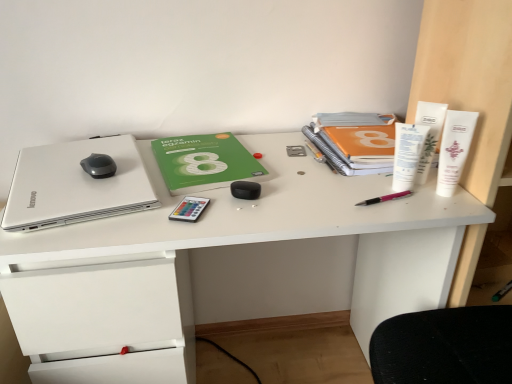
Image resolution: width=512 pixels, height=384 pixels. I want to click on free area in between black plastic remote control at center-left, positioned as the fifth stationery in right-to-left order, and white plastic tube at upper right, the 2th stationery positioned from the right, so click(x=298, y=197).